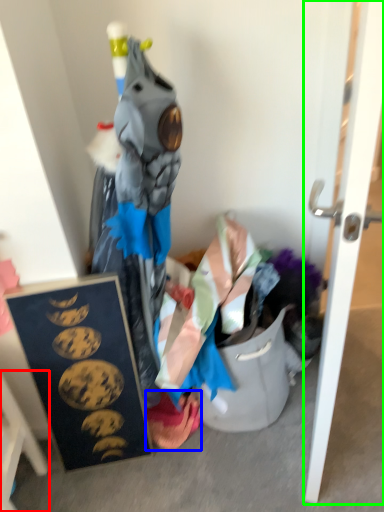
Question: Which object is the closest to the furniture (highlighted by a red box)? Choose among these: underclothes (highlighted by a blue box) or door (highlighted by a green box).

Choices:
 (A) underclothes
 (B) door

Answer: (A)